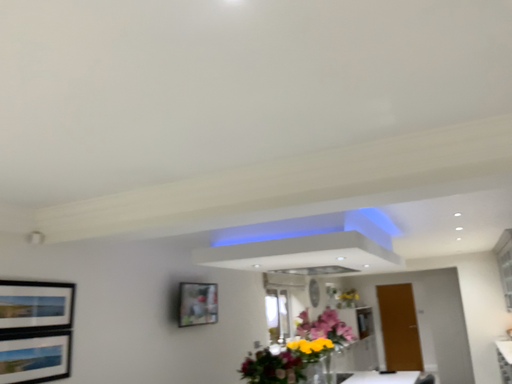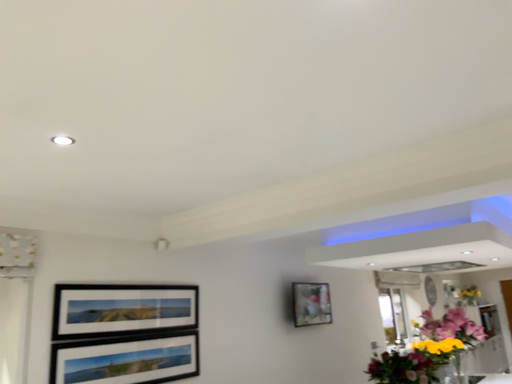
Question: How did the camera likely rotate when shooting the video?

Choices:
 (A) rotated left
 (B) rotated right

Answer: (A)